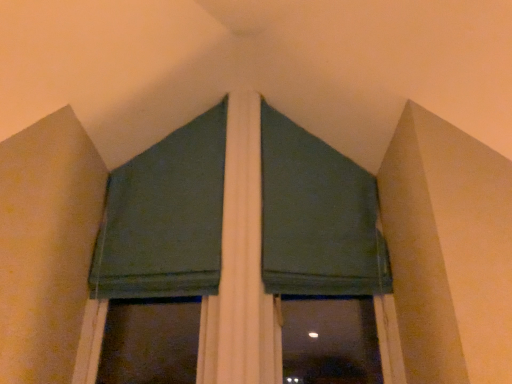
Question: Visually, is dark green fabric at upper center, the 2th curtain in the left-to-right sequence, positioned to the left or to the right of dark green fabric at center?

Choices:
 (A) right
 (B) left

Answer: (A)

Question: From their relative heights in the image, would you say dark green fabric at upper center, placed as the first curtain when sorted from right to left, is taller or shorter than dark green fabric at center?

Choices:
 (A) short
 (B) tall

Answer: (A)

Question: Which object is positioned closest to the dark green fabric at center?

Choices:
 (A) dark green fabric at upper center, the 2th curtain in the left-to-right sequence
 (B) dark green fabric at upper center, the second curtain from the right

Answer: (A)

Question: Which is farther from the dark green fabric at center?

Choices:
 (A) dark green fabric at upper center, marked as the first curtain in a left-to-right arrangement
 (B) dark green fabric at upper center, the 2th curtain in the left-to-right sequence

Answer: (A)